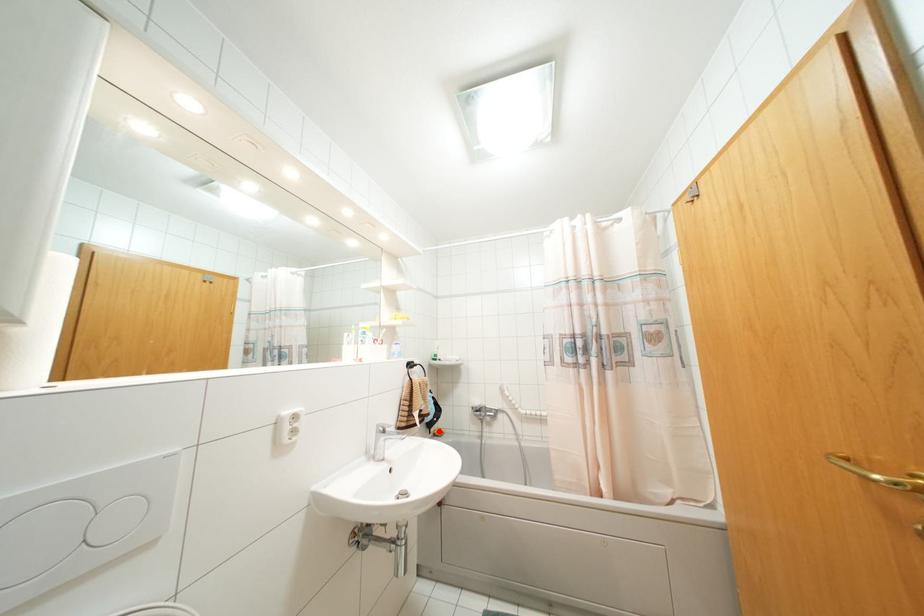
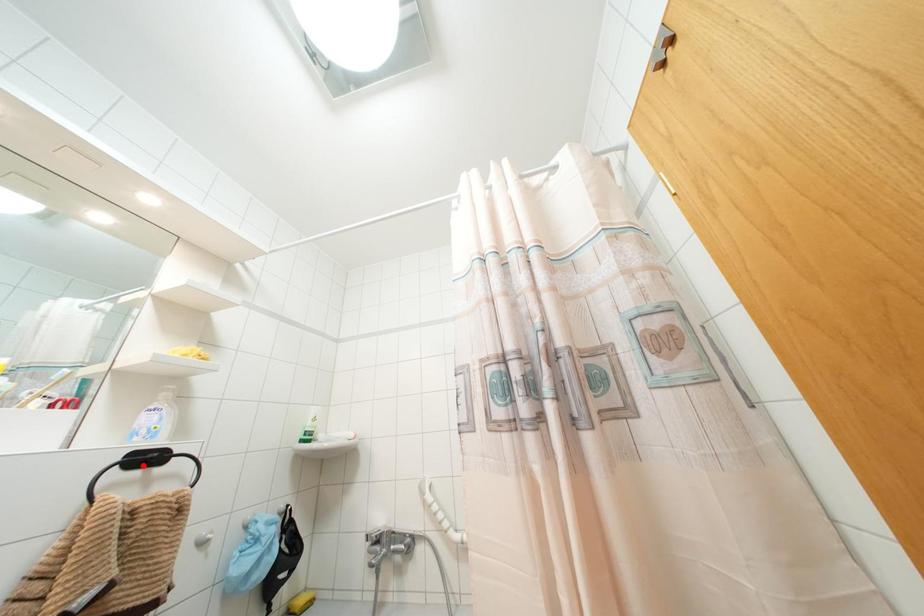
I am providing you with two images of the same scene from different viewpoints. A red point is marked on the first image and another point is marked on the second image. Is the marked point in image1 the same physical position as the marked point in image2?

No